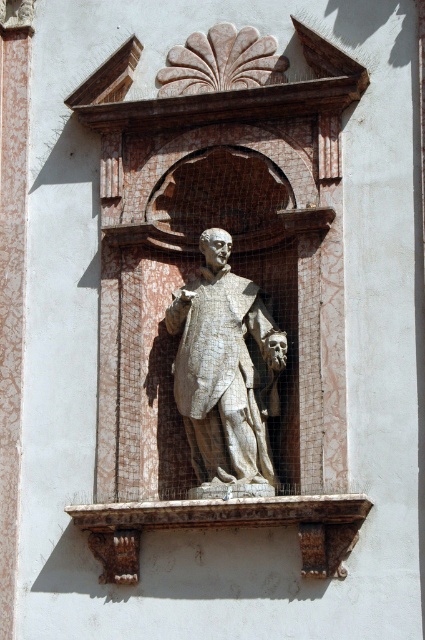
Question: Is white marble statue at center to the right of rustic stone ledge at center from the viewer's perspective?

Choices:
 (A) no
 (B) yes

Answer: (A)

Question: Which object appears closest to the camera in this image?

Choices:
 (A) rustic stone ledge at center
 (B) white marble statue at center

Answer: (A)

Question: Can you confirm if white marble statue at center is bigger than rustic stone ledge at center?

Choices:
 (A) yes
 (B) no

Answer: (B)

Question: Among these objects, which one is farthest from the camera?

Choices:
 (A) white marble statue at center
 (B) rustic stone ledge at center

Answer: (A)

Question: Is white marble statue at center to the left of rustic stone ledge at center from the viewer's perspective?

Choices:
 (A) yes
 (B) no

Answer: (A)

Question: Which object is closer to the camera taking this photo?

Choices:
 (A) white marble statue at center
 (B) rustic stone ledge at center

Answer: (B)